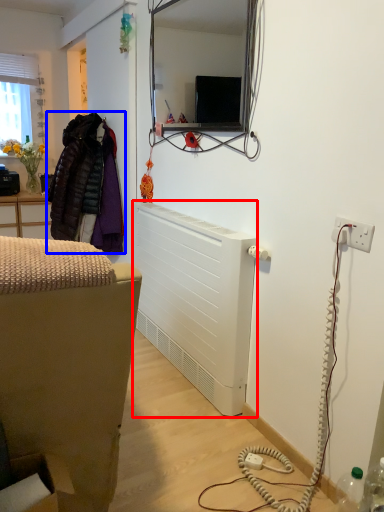
Question: Which of the following is the closest to the observer, radiator (highlighted by a red box) or jacket (highlighted by a blue box)?

Choices:
 (A) radiator
 (B) jacket

Answer: (A)